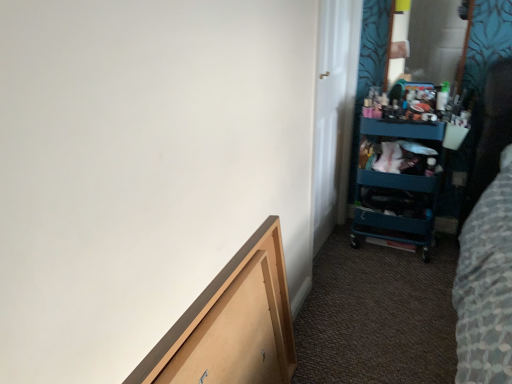
Question: From the image's perspective, is white glossy door at upper right over teal plastic cart at right?

Choices:
 (A) no
 (B) yes

Answer: (B)

Question: Considering the relative sizes of white glossy door at upper right and teal plastic cart at right in the image provided, is white glossy door at upper right wider than teal plastic cart at right?

Choices:
 (A) yes
 (B) no

Answer: (B)

Question: Is white glossy door at upper right touching teal plastic cart at right?

Choices:
 (A) no
 (B) yes

Answer: (A)

Question: Can you confirm if white glossy door at upper right is taller than teal plastic cart at right?

Choices:
 (A) no
 (B) yes

Answer: (B)

Question: Considering the relative positions of white glossy door at upper right and teal plastic cart at right in the image provided, is white glossy door at upper right to the left of teal plastic cart at right from the viewer's perspective?

Choices:
 (A) yes
 (B) no

Answer: (A)

Question: In terms of size, does wooden drawer at lower left appear bigger or smaller than teal plastic cart at right?

Choices:
 (A) big
 (B) small

Answer: (B)

Question: Is wooden drawer at lower left wider or thinner than teal plastic cart at right?

Choices:
 (A) wide
 (B) thin

Answer: (B)

Question: Is wooden drawer at lower left in front of or behind teal plastic cart at right in the image?

Choices:
 (A) behind
 (B) front

Answer: (B)

Question: Is wooden drawer at lower left inside or outside of teal plastic cart at right?

Choices:
 (A) inside
 (B) outside

Answer: (B)

Question: Is teal plastic cart at right spatially inside wooden drawer at lower left, or outside of it?

Choices:
 (A) inside
 (B) outside

Answer: (B)

Question: Considering the positions of teal plastic cart at right and wooden drawer at lower left in the image, is teal plastic cart at right wider or thinner than wooden drawer at lower left?

Choices:
 (A) thin
 (B) wide

Answer: (B)

Question: Considering the positions of teal plastic cart at right and wooden drawer at lower left in the image, is teal plastic cart at right bigger or smaller than wooden drawer at lower left?

Choices:
 (A) big
 (B) small

Answer: (A)

Question: From the image's perspective, is teal plastic cart at right positioned above or below wooden drawer at lower left?

Choices:
 (A) above
 (B) below

Answer: (A)

Question: From a real-world perspective, is wooden drawer at lower left above or below white glossy door at upper right?

Choices:
 (A) below
 (B) above

Answer: (A)

Question: Considering the positions of point (266, 337) and point (347, 135), is point (266, 337) closer or farther from the camera than point (347, 135)?

Choices:
 (A) farther
 (B) closer

Answer: (B)